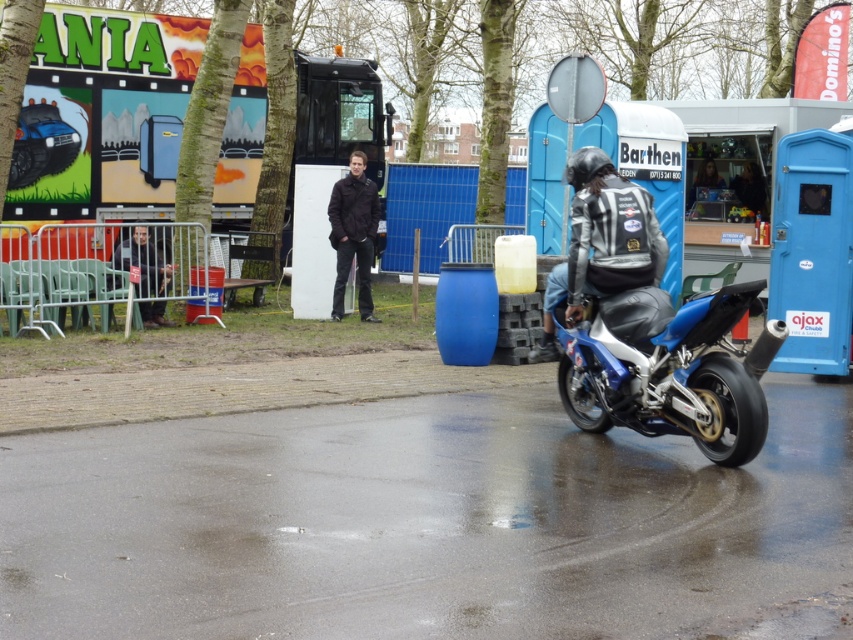
You are a photographer trying to capture the motorcyclist in the scene. The motorcyclist is wearing a dark brown leather jacket at center. If you want to focus on the jacket, which coordinates should you aim your camera at?

The dark brown leather jacket at center is located at point (352,234), so you should aim your camera at those coordinates to focus on it.

You are a photographer trying to capture the blue metallic motorcycle at lower right and the shiny black jacket at center in a single shot. Based on their sizes, which object should you focus on first to ensure both are in frame?

The blue metallic motorcycle at lower right is shorter than the shiny black jacket at center, so you should focus on the shiny black jacket at center first to ensure both are in frame.

You are a photographer standing in the scene and want to capture both the blue metallic motorcycle at lower right and the shiny black jacket at center in the same frame. Based on their positions, which object should you adjust your camera to focus on first to ensure both are in the shot?

The blue metallic motorcycle at lower right is to the right of the shiny black jacket at center. To include both in the frame, focus on the shiny black jacket at center first, then adjust the camera to include the motorcycle on its right side.